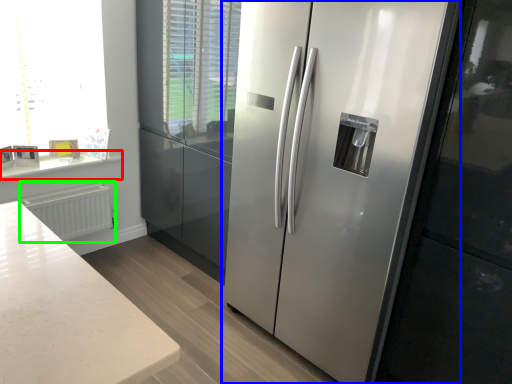
Question: Estimate the real-world distances between objects in this image. Which object is farther from counter top (highlighted by a red box), refrigerator (highlighted by a blue box) or radiator (highlighted by a green box)?

Choices:
 (A) refrigerator
 (B) radiator

Answer: (A)